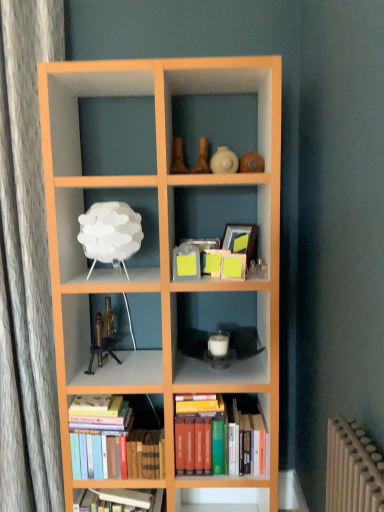
What do you see at coordinates (103, 337) in the screenshot? I see `brass metallic microscope at center-left` at bounding box center [103, 337].

Describe the element at coordinates (235, 364) in the screenshot. I see `white matte candle at center, marked as the first shelf in a bottom-to-top arrangement` at that location.

This screenshot has width=384, height=512. Identify the location of white matte lamp at upper left, acting as the 1th shelf starting from the left. (69, 233).

What is the approximate height of white matte lamp at upper left, arranged as the 1th shelf when viewed from the top?

white matte lamp at upper left, arranged as the 1th shelf when viewed from the top, is 12.67 inches in height.

Identify the location of hardcover books at center, the 2th book from the left. This screenshot has height=512, width=384. (219, 438).

Where is `brass metallic microscope at center-left`? Image resolution: width=384 pixels, height=512 pixels. brass metallic microscope at center-left is located at coordinates (103, 337).

Is white matte lamp at upper left, the 2th shelf positioned from the right, next to white matte candle at center, which is the first shelf from right to left, and touching it?

No, white matte lamp at upper left, the 2th shelf positioned from the right, is not beside white matte candle at center, which is the first shelf from right to left.

Does white matte lamp at upper left, the second shelf from the bottom, lie in front of white matte candle at center, marked as the first shelf in a bottom-to-top arrangement?

Yes, white matte lamp at upper left, the second shelf from the bottom, is in front of white matte candle at center, marked as the first shelf in a bottom-to-top arrangement.

Can you confirm if white matte lamp at upper left, the second shelf from the bottom, is smaller than white matte candle at center, the 2th shelf viewed from the left?

No, white matte lamp at upper left, the second shelf from the bottom, is not smaller than white matte candle at center, the 2th shelf viewed from the left.

From a real-world perspective, does white matte lamp at upper left, the second shelf from the bottom, stand above white matte candle at center, the second shelf in the top-to-bottom sequence?

Yes, from a real-world perspective, white matte lamp at upper left, the second shelf from the bottom, is over white matte candle at center, the second shelf in the top-to-bottom sequence

Looking at their sizes, would you say brass metallic microscope at center-left is wider or thinner than white matte lamp at upper left, arranged as the 1th shelf when viewed from the top?

brass metallic microscope at center-left is thinner than white matte lamp at upper left, arranged as the 1th shelf when viewed from the top.

Considering the relative sizes of brass metallic microscope at center-left and white matte lamp at upper left, arranged as the 1th shelf when viewed from the top, in the image provided, is brass metallic microscope at center-left smaller than white matte lamp at upper left, arranged as the 1th shelf when viewed from the top,?

Yes.

Between brass metallic microscope at center-left and white matte lamp at upper left, the second shelf from the bottom, which one has less height?

brass metallic microscope at center-left.

Is point (97, 347) less distant than point (66, 240)?

No, (97, 347) is behind (66, 240).

In the image, is hardcover books at bottom left, acting as the 2th book starting from the right, on the left side or the right side of hardcover books at center, the 2th book from the left?

Based on their positions, hardcover books at bottom left, acting as the 2th book starting from the right, is located to the left of hardcover books at center, the 2th book from the left.

Based on the photo, between hardcover books at bottom left, acting as the 2th book starting from the right, and hardcover books at center, arranged as the 1th book when viewed from the right, which one has more height?

hardcover books at center, arranged as the 1th book when viewed from the right.

From the picture: From a real-world perspective, does hardcover books at center, arranged as the 1th book when viewed from the right, sit lower than hardcover books at bottom left, the first book positioned from the left?

Incorrect, from a real-world perspective, hardcover books at center, arranged as the 1th book when viewed from the right, is higher than hardcover books at bottom left, the first book positioned from the left.

Which object is closer to the camera taking this photo, hardcover books at center, the 2th book from the left, or hardcover books at bottom left, the first book positioned from the left?

Positioned in front is hardcover books at bottom left, the first book positioned from the left.

From the image's perspective, between hardcover books at center, arranged as the 1th book when viewed from the right, and hardcover books at bottom left, acting as the 2th book starting from the right, who is located below?

hardcover books at bottom left, acting as the 2th book starting from the right, from the image's perspective.

Which of these two, hardcover books at center, arranged as the 1th book when viewed from the right, or hardcover books at bottom left, acting as the 2th book starting from the right, is thinner?

hardcover books at bottom left, acting as the 2th book starting from the right, is thinner.

Can you confirm if hardcover books at center, the 2th book from the left, is positioned to the left of white matte lamp at upper left, the second shelf from the bottom?

Incorrect, hardcover books at center, the 2th book from the left, is not on the left side of white matte lamp at upper left, the second shelf from the bottom.

How much distance is there between hardcover books at center, arranged as the 1th book when viewed from the right, and white matte lamp at upper left, the 2th shelf positioned from the right?

34.83 inches.

Is hardcover books at center, the 2th book from the left, further to the viewer compared to white matte lamp at upper left, acting as the 1th shelf starting from the left?

Yes, hardcover books at center, the 2th book from the left, is further from the camera.

Is point (236, 438) closer or farther from the camera than point (56, 209)?

Point (236, 438) appears to be farther away from the viewer than point (56, 209).

Considering the relative sizes of brass metallic microscope at center-left and hardcover books at bottom left, acting as the 2th book starting from the right, in the image provided, is brass metallic microscope at center-left thinner than hardcover books at bottom left, acting as the 2th book starting from the right,?

In fact, brass metallic microscope at center-left might be wider than hardcover books at bottom left, acting as the 2th book starting from the right.

In terms of height, does brass metallic microscope at center-left look taller or shorter compared to hardcover books at bottom left, the first book positioned from the left?

Clearly, brass metallic microscope at center-left is shorter compared to hardcover books at bottom left, the first book positioned from the left.

Who is smaller, brass metallic microscope at center-left or hardcover books at bottom left, acting as the 2th book starting from the right?

With smaller size is brass metallic microscope at center-left.

Can you tell me how much brass metallic microscope at center-left and hardcover books at bottom left, acting as the 2th book starting from the right, differ in facing direction?

3.2 degrees separate the facing orientations of brass metallic microscope at center-left and hardcover books at bottom left, acting as the 2th book starting from the right.

Which object is closer to the camera taking this photo, white matte lamp at upper left, arranged as the 1th shelf when viewed from the top, or hardcover books at bottom left, acting as the 2th book starting from the right?

Positioned in front is white matte lamp at upper left, arranged as the 1th shelf when viewed from the top.

Is white matte lamp at upper left, arranged as the 1th shelf when viewed from the top, touching hardcover books at bottom left, acting as the 2th book starting from the right?

There is a gap between white matte lamp at upper left, arranged as the 1th shelf when viewed from the top, and hardcover books at bottom left, acting as the 2th book starting from the right.

Does white matte lamp at upper left, arranged as the 1th shelf when viewed from the top, have a lesser height compared to hardcover books at bottom left, acting as the 2th book starting from the right?

Correct, white matte lamp at upper left, arranged as the 1th shelf when viewed from the top, is not as tall as hardcover books at bottom left, acting as the 2th book starting from the right.

Identify the location of shelf on the left of white matte candle at center, marked as the first shelf in a bottom-to-top arrangement. (69, 233).

The image size is (384, 512). I want to click on the 1st shelf to the right of the brass metallic microscope at center-left, starting your count from the anchor, so click(x=69, y=233).

Which object lies nearer to the anchor point hardcover books at center, arranged as the 1th book when viewed from the right, hardcover books at bottom left, the first book positioned from the left, or brass metallic microscope at center-left?

Based on the image, hardcover books at bottom left, the first book positioned from the left, appears to be nearer to hardcover books at center, arranged as the 1th book when viewed from the right.

From the image, which object appears to be farther from hardcover books at bottom left, acting as the 2th book starting from the right, brass metallic microscope at center-left or hardcover books at center, the 2th book from the left?

brass metallic microscope at center-left is further to hardcover books at bottom left, acting as the 2th book starting from the right.

In the scene shown: Based on their spatial positions, is white matte lamp at upper left, arranged as the 1th shelf when viewed from the top, or hardcover books at center, arranged as the 1th book when viewed from the right, further from white matte candle at center, the second shelf in the top-to-bottom sequence?

white matte lamp at upper left, arranged as the 1th shelf when viewed from the top, is further to white matte candle at center, the second shelf in the top-to-bottom sequence.

Considering their positions, is white matte candle at center, which is the first shelf from right to left, positioned closer to brass metallic microscope at center-left than hardcover books at bottom left, the first book positioned from the left?

hardcover books at bottom left, the first book positioned from the left.

Estimate the real-world distances between objects in this image. Which object is closer to white matte lamp at upper left, the 2th shelf positioned from the right, hardcover books at center, the 2th book from the left, or hardcover books at bottom left, acting as the 2th book starting from the right?

Among the two, hardcover books at bottom left, acting as the 2th book starting from the right, is located nearer to white matte lamp at upper left, the 2th shelf positioned from the right.

Which object lies further to the anchor point brass metallic microscope at center-left, white matte lamp at upper left, arranged as the 1th shelf when viewed from the top, or hardcover books at center, the 2th book from the left?

hardcover books at center, the 2th book from the left, is further to brass metallic microscope at center-left.

When comparing their distances from white matte candle at center, the 2th shelf viewed from the left, does white matte lamp at upper left, acting as the 1th shelf starting from the left, or hardcover books at bottom left, acting as the 2th book starting from the right, seem closer?

hardcover books at bottom left, acting as the 2th book starting from the right, is closer to white matte candle at center, the 2th shelf viewed from the left.

Based on their spatial positions, is white matte lamp at upper left, the second shelf from the bottom, or white matte candle at center, marked as the first shelf in a bottom-to-top arrangement, further from hardcover books at bottom left, the first book positioned from the left?

white matte lamp at upper left, the second shelf from the bottom, is positioned further to the anchor hardcover books at bottom left, the first book positioned from the left.

Locate an element on the screen. toy between white matte lamp at upper left, the second shelf from the bottom, and hardcover books at bottom left, the first book positioned from the left, in the up-down direction is located at coordinates (x=103, y=337).

Identify the location of toy between white matte lamp at upper left, the 2th shelf positioned from the right, and hardcover books at center, the 2th book from the left, from top to bottom. This screenshot has height=512, width=384. (103, 337).

Identify the location of shelf situated between hardcover books at bottom left, acting as the 2th book starting from the right, and hardcover books at center, the 2th book from the left, from left to right. This screenshot has height=512, width=384. (235, 364).

Where is `shelf between white matte lamp at upper left, acting as the 1th shelf starting from the left, and hardcover books at bottom left, acting as the 2th book starting from the right, vertically`? shelf between white matte lamp at upper left, acting as the 1th shelf starting from the left, and hardcover books at bottom left, acting as the 2th book starting from the right, vertically is located at coordinates (235, 364).